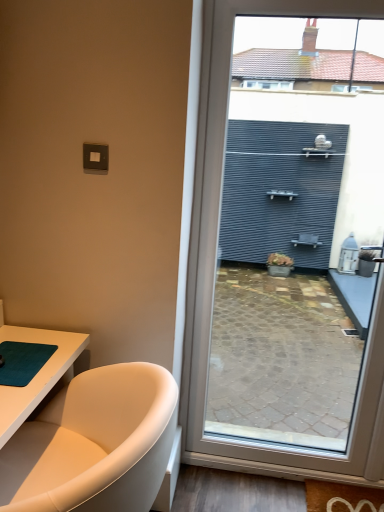
Question: Does point (139, 489) appear closer or farther from the camera than point (223, 37)?

Choices:
 (A) farther
 (B) closer

Answer: (B)

Question: Is white leather bathtub at lower left situated inside matte gray wall at right or outside?

Choices:
 (A) outside
 (B) inside

Answer: (A)

Question: Based on their relative distances, which object is nearer to the teal matte yoga mat at lower left?

Choices:
 (A) white leather bathtub at lower left
 (B) matte gray wall at right

Answer: (A)

Question: Estimate the real-world distances between objects in this image. Which object is closer to the matte gray wall at right?

Choices:
 (A) white leather bathtub at lower left
 (B) teal matte yoga mat at lower left

Answer: (A)